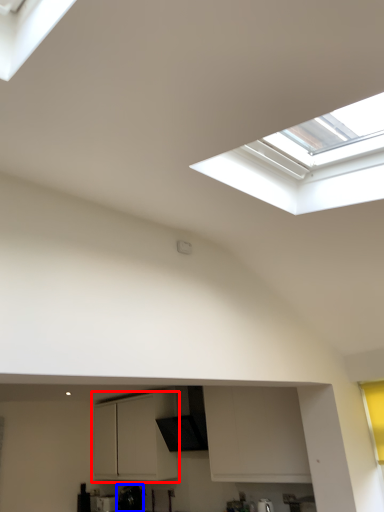
Question: Which object is closer to the camera taking this photo, cabinetry (highlighted by a red box) or appliance (highlighted by a blue box)?

Choices:
 (A) cabinetry
 (B) appliance

Answer: (A)